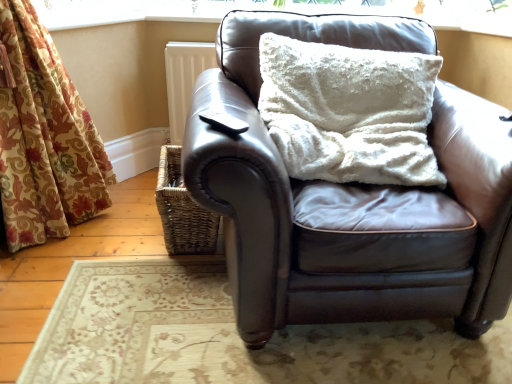
Question: From a real-world perspective, relative to woven brown basket at lower left, is white fluffy pillow at upper center vertically above or below?

Choices:
 (A) below
 (B) above

Answer: (B)

Question: Looking at their shapes, would you say white fluffy pillow at upper center is wider or thinner than woven brown basket at lower left?

Choices:
 (A) thin
 (B) wide

Answer: (B)

Question: Considering the real-world distances, which object is farthest from the white textured cushion at upper center?

Choices:
 (A) white fluffy pillow at upper center
 (B) woven brown basket at lower left
 (C) black matte remote control at upper center
 (D) matte brown leather couch at center

Answer: (D)

Question: Estimate the real-world distances between objects in this image. Which object is farther from the black matte remote control at upper center?

Choices:
 (A) white fluffy pillow at upper center
 (B) woven brown basket at lower left
 (C) matte brown leather couch at center
 (D) white textured cushion at upper center

Answer: (D)